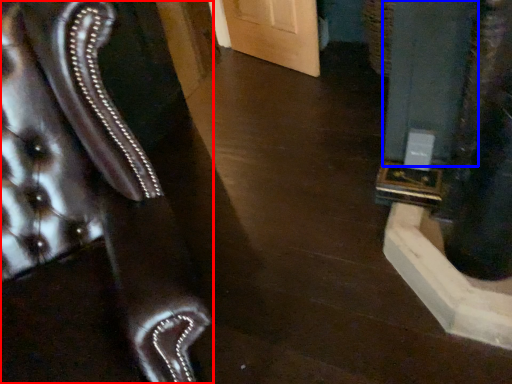
Question: Which point is further to the camera, furniture (highlighted by a red box) or pillar (highlighted by a blue box)?

Choices:
 (A) furniture
 (B) pillar

Answer: (B)